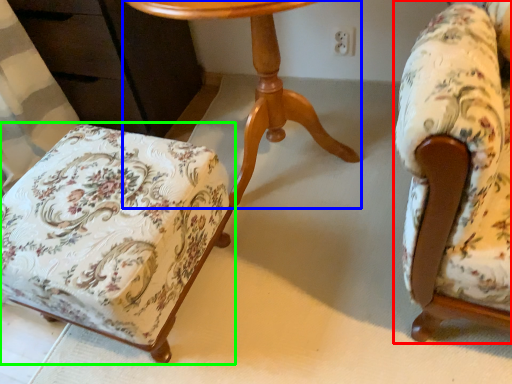
Question: Which object is positioned farthest from chair (highlighted by a red box)? Select from table (highlighted by a blue box) and chair (highlighted by a green box).

Choices:
 (A) table
 (B) chair

Answer: (B)